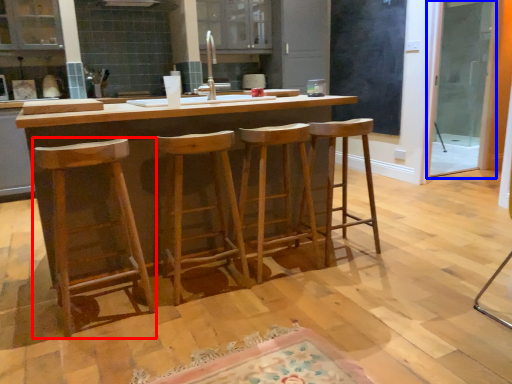
Question: Which object is closer to the camera taking this photo, stool (highlighted by a red box) or screen door (highlighted by a blue box)?

Choices:
 (A) stool
 (B) screen door

Answer: (A)